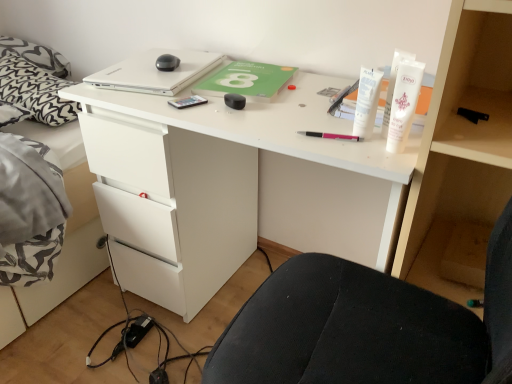
Find the location of a particular element. This screenshot has width=512, height=384. vacant area to the right of pink plastic pen at center, placed as the second stationery when sorted from right to left is located at coordinates (377, 142).